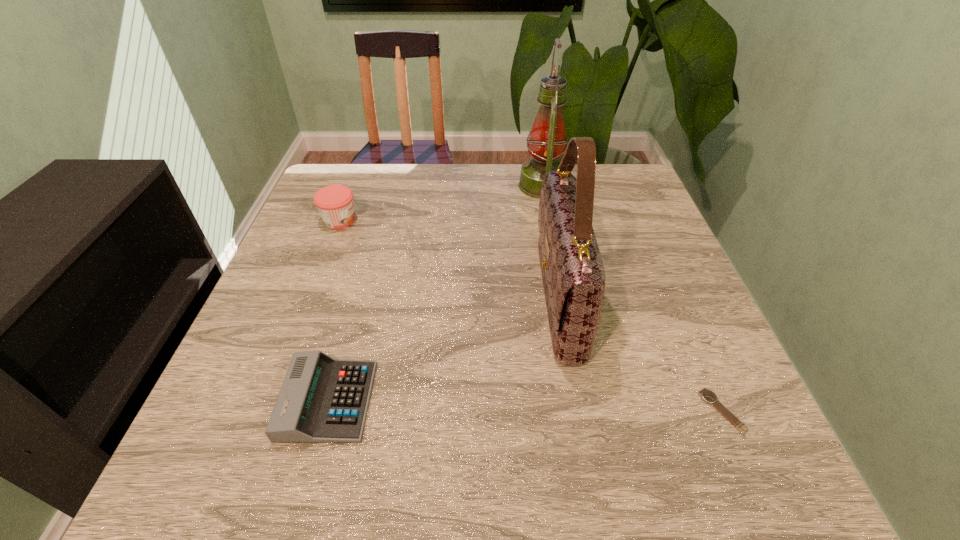
Find the location of a particular element. Image resolution: width=960 pixels, height=540 pixels. blank space located 0.400m on the front of the handbag with the clasp is located at coordinates (350, 299).

Image resolution: width=960 pixels, height=540 pixels. Identify the location of vacant space located on the front label of the third shortest object. (497, 220).

Where is `free spot located on the back of the calculator`? free spot located on the back of the calculator is located at coordinates (365, 269).

You are a GUI agent. You are given a task and a screenshot of the screen. Output one action in this format:
    pyautogui.click(x=<x>, y=<y>)
    Task: Click on the vacant space situated 0.090m on the left of the rightmost object
    
    Given the screenshot: What is the action you would take?
    pyautogui.click(x=653, y=411)

Where is `oil lamp located in the far edge section of the desktop`? oil lamp located in the far edge section of the desktop is located at coordinates (547, 142).

This screenshot has width=960, height=540. I want to click on jam that is at the far edge, so click(335, 204).

The height and width of the screenshot is (540, 960). In order to click on object at the near edge in this screenshot , I will do `click(322, 400)`.

At what (x,y) coordinates should I click in order to perform the action: click on jam that is at the left edge. Please return your answer as a coordinate pair (x, y). This screenshot has height=540, width=960. Looking at the image, I should click on (335, 204).

What are the coordinates of `calculator that is at the left edge` in the screenshot? It's located at (322, 400).

This screenshot has width=960, height=540. I want to click on object located at the right edge, so click(707, 395).